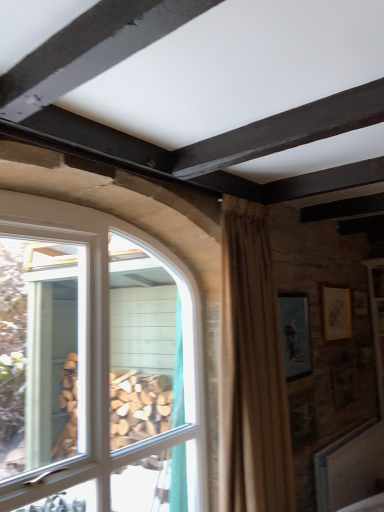
Image resolution: width=384 pixels, height=512 pixels. Describe the element at coordinates (336, 312) in the screenshot. I see `matte gold picture frame at upper right, arranged as the 2th picture frame when viewed from the front` at that location.

Describe the element at coordinates (295, 335) in the screenshot. I see `matte blue picture frame at upper right, which appears as the 2th picture frame when viewed from the back` at that location.

The width and height of the screenshot is (384, 512). Describe the element at coordinates (164, 267) in the screenshot. I see `white glass window at left` at that location.

I want to click on matte gold picture frame at upper right, which ranks as the second picture frame in left-to-right order, so click(336, 312).

From a real-world perspective, is matte gold picture frame at upper right, marked as the 1th picture frame in a back-to-front arrangement, positioned above or below matte blue picture frame at upper right, the first picture frame from the left?

matte gold picture frame at upper right, marked as the 1th picture frame in a back-to-front arrangement, is situated higher than matte blue picture frame at upper right, the first picture frame from the left, in the real world.

The image size is (384, 512). I want to click on picture frame lying in front of the matte gold picture frame at upper right, arranged as the 2th picture frame when viewed from the front, so click(295, 335).

In terms of width, does matte gold picture frame at upper right, arranged as the 2th picture frame when viewed from the front, look wider or thinner when compared to matte blue picture frame at upper right, the first picture frame from the left?

matte gold picture frame at upper right, arranged as the 2th picture frame when viewed from the front, is wider than matte blue picture frame at upper right, the first picture frame from the left.

Does beige textured curtain at center come in front of white glass window at left?

No, beige textured curtain at center is further to the viewer.

Which of these two, beige textured curtain at center or white glass window at left, stands taller?

white glass window at left is taller.

Is beige textured curtain at center far from white glass window at left?

That's not correct — beige textured curtain at center is a little close to white glass window at left.

Is point (9, 211) closer to camera compared to point (227, 351)?

Yes, point (9, 211) is closer to viewer.

Does white glass window at left have a larger size compared to beige textured curtain at center?

Indeed, white glass window at left has a larger size compared to beige textured curtain at center.

Could beige textured curtain at center be considered to be inside white glass window at left?

No, beige textured curtain at center is located outside of white glass window at left.

From a real-world perspective, between white glass window at left and beige textured curtain at center, who is vertically higher?

beige textured curtain at center is physically above.

Between point (324, 292) and point (101, 506), which one is positioned in front?

Positioned in front is point (101, 506).

Is matte gold picture frame at upper right, marked as the 1th picture frame in a back-to-front arrangement, thinner than white glass window at left?

Correct, the width of matte gold picture frame at upper right, marked as the 1th picture frame in a back-to-front arrangement, is less than that of white glass window at left.

Considering the relative sizes of matte gold picture frame at upper right, placed as the 1th picture frame when sorted from right to left, and white glass window at left in the image provided, is matte gold picture frame at upper right, placed as the 1th picture frame when sorted from right to left, taller than white glass window at left?

No.

Can you confirm if beige textured curtain at center is positioned to the right of matte gold picture frame at upper right, which ranks as the second picture frame in left-to-right order?

No, beige textured curtain at center is not to the right of matte gold picture frame at upper right, which ranks as the second picture frame in left-to-right order.

Which of these two, beige textured curtain at center or matte gold picture frame at upper right, marked as the 1th picture frame in a back-to-front arrangement, is thinner?

matte gold picture frame at upper right, marked as the 1th picture frame in a back-to-front arrangement.

Where is `the 2nd picture frame behind the beige textured curtain at center`? the 2nd picture frame behind the beige textured curtain at center is located at coordinates (336, 312).

Measure the distance from beige textured curtain at center to matte gold picture frame at upper right, marked as the 1th picture frame in a back-to-front arrangement.

A distance of 3.64 feet exists between beige textured curtain at center and matte gold picture frame at upper right, marked as the 1th picture frame in a back-to-front arrangement.

From a real-world perspective, which is physically below, matte blue picture frame at upper right, which appears as the 2th picture frame when viewed from the back, or matte gold picture frame at upper right, placed as the 1th picture frame when sorted from right to left?

In real-world perspective, matte blue picture frame at upper right, which appears as the 2th picture frame when viewed from the back, is lower.

Would you say matte blue picture frame at upper right, which ranks as the first picture frame in front-to-back order, is outside matte gold picture frame at upper right, placed as the 1th picture frame when sorted from right to left?

Yes, matte blue picture frame at upper right, which ranks as the first picture frame in front-to-back order, is not within matte gold picture frame at upper right, placed as the 1th picture frame when sorted from right to left.

Does point (311, 367) appear closer or farther from the camera than point (349, 309)?

Point (311, 367) is positioned closer to the camera compared to point (349, 309).

Is matte blue picture frame at upper right, which ranks as the first picture frame in front-to-back order, facing away from matte gold picture frame at upper right, marked as the 1th picture frame in a back-to-front arrangement?

matte blue picture frame at upper right, which ranks as the first picture frame in front-to-back order, does not have its back to matte gold picture frame at upper right, marked as the 1th picture frame in a back-to-front arrangement.

Can you tell me how much matte blue picture frame at upper right, which ranks as the first picture frame in front-to-back order, and white glass window at left differ in facing direction?

matte blue picture frame at upper right, which ranks as the first picture frame in front-to-back order, and white glass window at left are facing 0.586 degrees away from each other.

Between matte blue picture frame at upper right, which ranks as the first picture frame in front-to-back order, and white glass window at left, which one has smaller width?

With smaller width is matte blue picture frame at upper right, which ranks as the first picture frame in front-to-back order.

Considering the sizes of objects matte blue picture frame at upper right, which appears as the 2th picture frame when viewed from the back, and white glass window at left in the image provided, who is bigger, matte blue picture frame at upper right, which appears as the 2th picture frame when viewed from the back, or white glass window at left?

Bigger between the two is white glass window at left.

Is point (296, 326) closer or farther from the camera than point (196, 341)?

Point (296, 326) appears to be farther away from the viewer than point (196, 341).

Identify the location of picture frame lying below the matte gold picture frame at upper right, placed as the 1th picture frame when sorted from right to left (from the image's perspective). (295, 335).

Locate an element on the screen. curtain located on the right of white glass window at left is located at coordinates (251, 370).

Which object lies further to the anchor point beige textured curtain at center, matte blue picture frame at upper right, arranged as the second picture frame when viewed from the right, or white glass window at left?

matte blue picture frame at upper right, arranged as the second picture frame when viewed from the right.

When comparing their distances from matte blue picture frame at upper right, which ranks as the first picture frame in front-to-back order, does beige textured curtain at center or matte gold picture frame at upper right, marked as the 1th picture frame in a back-to-front arrangement, seem further?

The object further to matte blue picture frame at upper right, which ranks as the first picture frame in front-to-back order, is matte gold picture frame at upper right, marked as the 1th picture frame in a back-to-front arrangement.

Which object lies nearer to the anchor point white glass window at left, matte blue picture frame at upper right, the first picture frame from the left, or matte gold picture frame at upper right, which ranks as the second picture frame in left-to-right order?

Among the two, matte blue picture frame at upper right, the first picture frame from the left, is located nearer to white glass window at left.

Which object lies nearer to the anchor point matte gold picture frame at upper right, placed as the 1th picture frame when sorted from right to left, matte blue picture frame at upper right, which appears as the 2th picture frame when viewed from the back, or white glass window at left?

matte blue picture frame at upper right, which appears as the 2th picture frame when viewed from the back, is positioned closer to the anchor matte gold picture frame at upper right, placed as the 1th picture frame when sorted from right to left.

Considering their positions, is beige textured curtain at center positioned closer to matte gold picture frame at upper right, placed as the 1th picture frame when sorted from right to left, than white glass window at left?

beige textured curtain at center.

Based on their spatial positions, is beige textured curtain at center or matte blue picture frame at upper right, which ranks as the first picture frame in front-to-back order, closer to white glass window at left?

beige textured curtain at center.

From the image, which object appears to be farther from beige textured curtain at center, matte gold picture frame at upper right, placed as the 1th picture frame when sorted from right to left, or matte blue picture frame at upper right, the first picture frame from the left?

matte gold picture frame at upper right, placed as the 1th picture frame when sorted from right to left.

Which object lies nearer to the anchor point beige textured curtain at center, matte blue picture frame at upper right, arranged as the second picture frame when viewed from the right, or matte gold picture frame at upper right, arranged as the 2th picture frame when viewed from the front?

The object closer to beige textured curtain at center is matte blue picture frame at upper right, arranged as the second picture frame when viewed from the right.

Image resolution: width=384 pixels, height=512 pixels. Find the location of `picture frame between beige textured curtain at center and matte gold picture frame at upper right, placed as the 1th picture frame when sorted from right to left, in the front-back direction`. picture frame between beige textured curtain at center and matte gold picture frame at upper right, placed as the 1th picture frame when sorted from right to left, in the front-back direction is located at coordinates (295, 335).

What are the coordinates of `curtain between white glass window at left and matte blue picture frame at upper right, which ranks as the first picture frame in front-to-back order, from left to right` in the screenshot? It's located at (251, 370).

Locate an element on the screen. The width and height of the screenshot is (384, 512). curtain between white glass window at left and matte gold picture frame at upper right, arranged as the 2th picture frame when viewed from the front, in the front-back direction is located at coordinates (251, 370).

This screenshot has width=384, height=512. I want to click on picture frame between white glass window at left and matte gold picture frame at upper right, arranged as the 2th picture frame when viewed from the front, from left to right, so click(295, 335).